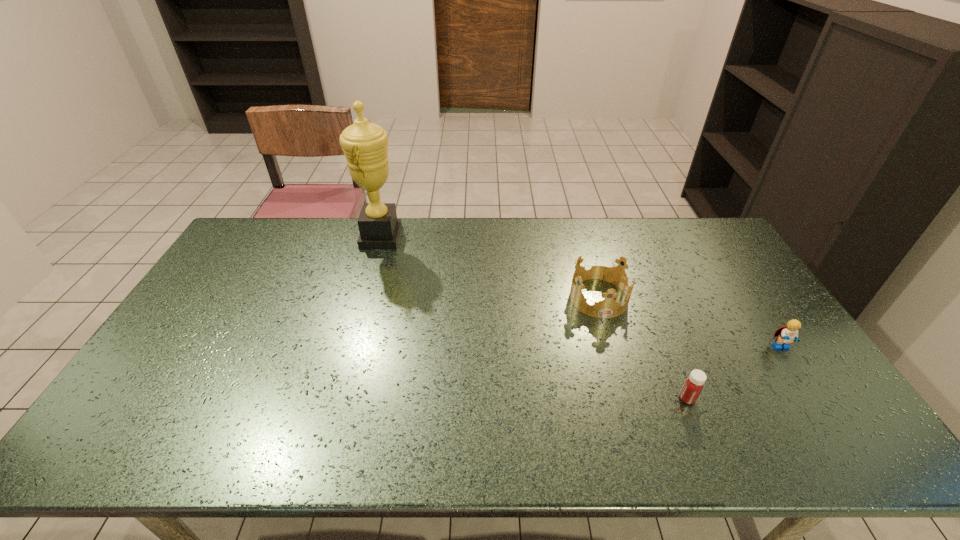
Find the location of `the leftmost object`. the leftmost object is located at coordinates (364, 144).

I want to click on the tallest object, so point(364,144).

Locate an element on the screen. the second object from left to right is located at coordinates (608, 308).

This screenshot has width=960, height=540. I want to click on the third nearest object, so click(608, 308).

What are the coordinates of `the second nearest object` in the screenshot? It's located at (785, 335).

This screenshot has height=540, width=960. I want to click on Lego, so click(x=785, y=335).

Identify the location of medicine. (693, 385).

The image size is (960, 540). I want to click on the third object from left to right, so click(693, 385).

Identify the location of free spot located at the front of the tallest object with handles. Image resolution: width=960 pixels, height=540 pixels. (489, 237).

This screenshot has height=540, width=960. Find the location of `vacant space located on the front-facing side of the third object from right to left`. vacant space located on the front-facing side of the third object from right to left is located at coordinates (631, 407).